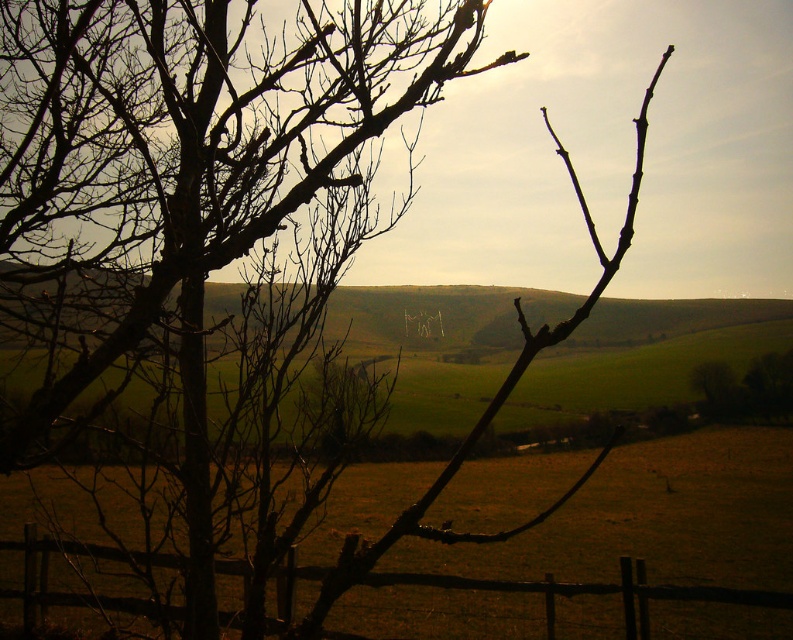
You are an artist sketching this scene and want to ensure the proportions are accurate. Given the brown rough branches at left and the brown wooden fence at lower center, which object should you draw first to establish the scale of the scene?

You should draw the brown wooden fence at lower center first because it is larger than the brown rough branches at left, helping to establish the scale of the scene.

You are a painter standing in front of the scene. You want to paint the brown rough branches at left and the brown wooden fence at lower center. Which object should you paint first if you follow the rule of painting closer objects before distant ones?

You should paint the brown rough branches at left first because they are closer to the viewer than the brown wooden fence at lower center.

You are an artist sketching this scene and want to ensure the brown rough branches at left and brown wooden fence at lower center are proportionally accurate. Which object should you draw with a narrower width?

The brown rough branches at left should be drawn with a narrower width since they are described as having a lesser width compared to the brown wooden fence at lower center.